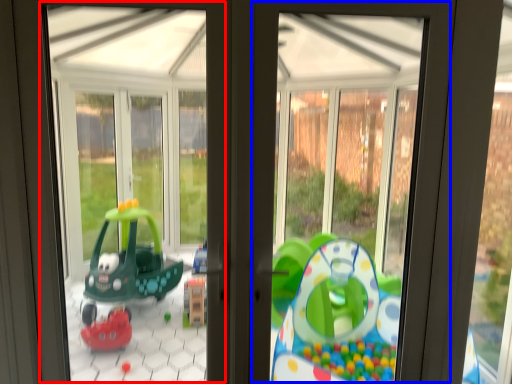
Question: Among these objects, which one is farthest to the camera, bay window (highlighted by a red box) or window frame (highlighted by a blue box)?

Choices:
 (A) bay window
 (B) window frame

Answer: (B)